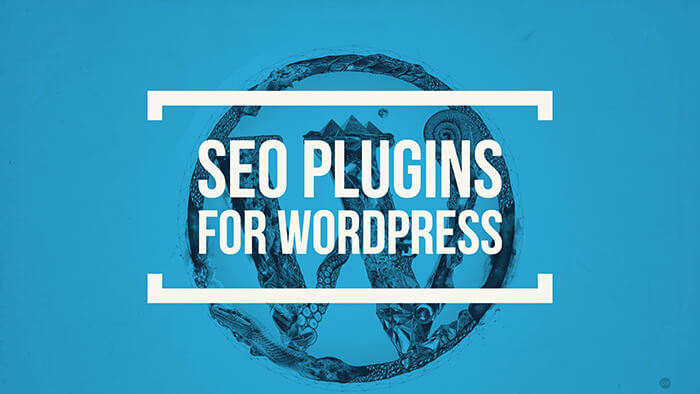
What are the coordinates of `right corners` in the screenshot? It's located at (693, 388), (693, 7).